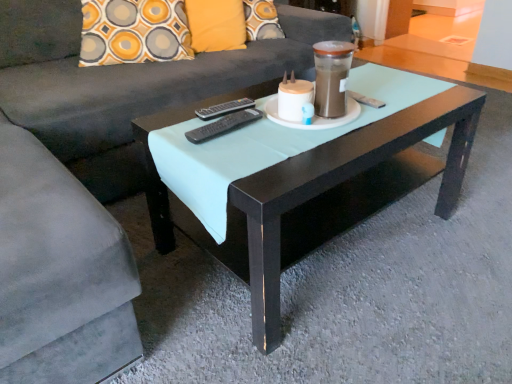
Question: Considering the relative sizes of suede gray couch at center and black plastic remote at center, the 1th remote in the back-to-front sequence, in the image provided, is suede gray couch at center wider than black plastic remote at center, the 1th remote in the back-to-front sequence,?

Choices:
 (A) yes
 (B) no

Answer: (A)

Question: Is black plastic remote at center, the second remote viewed from the front, a part of suede gray couch at center?

Choices:
 (A) no
 (B) yes

Answer: (B)

Question: Can you confirm if suede gray couch at center is smaller than black plastic remote at center, the 1th remote in the back-to-front sequence?

Choices:
 (A) yes
 (B) no

Answer: (B)

Question: Is suede gray couch at center next to black plastic remote at center, the 1th remote in the back-to-front sequence, and touching it?

Choices:
 (A) yes
 (B) no

Answer: (B)

Question: Is suede gray couch at center not close to black plastic remote at center, the 1th remote in the back-to-front sequence?

Choices:
 (A) yes
 (B) no

Answer: (B)

Question: Is suede gray couch at center facing away from black plastic remote at center, the second remote viewed from the front?

Choices:
 (A) no
 (B) yes

Answer: (A)

Question: From the image's perspective, would you say black plastic remote at center, which is counted as the second remote, starting from the back, is positioned over suede gray couch at center?

Choices:
 (A) no
 (B) yes

Answer: (A)

Question: From a real-world perspective, is black plastic remote at center, the first remote in the front-to-back sequence, positioned over suede gray couch at center based on gravity?

Choices:
 (A) yes
 (B) no

Answer: (A)

Question: Is the position of black plastic remote at center, which is counted as the second remote, starting from the back, less distant than that of suede gray couch at center?

Choices:
 (A) no
 (B) yes

Answer: (A)

Question: From the image's perspective, is black plastic remote at center, which is counted as the second remote, starting from the back, under suede gray couch at center?

Choices:
 (A) no
 (B) yes

Answer: (B)

Question: Considering the relative sizes of black plastic remote at center, the first remote in the front-to-back sequence, and suede gray couch at center in the image provided, is black plastic remote at center, the first remote in the front-to-back sequence, shorter than suede gray couch at center?

Choices:
 (A) yes
 (B) no

Answer: (A)

Question: Does suede gray couch at center appear on the left side of black matte coffee table at center?

Choices:
 (A) yes
 (B) no

Answer: (A)